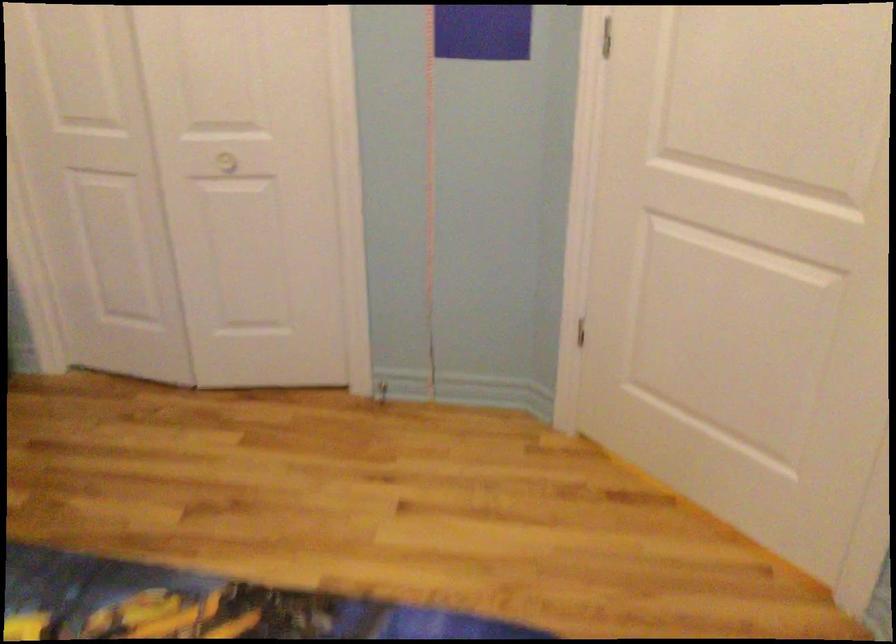
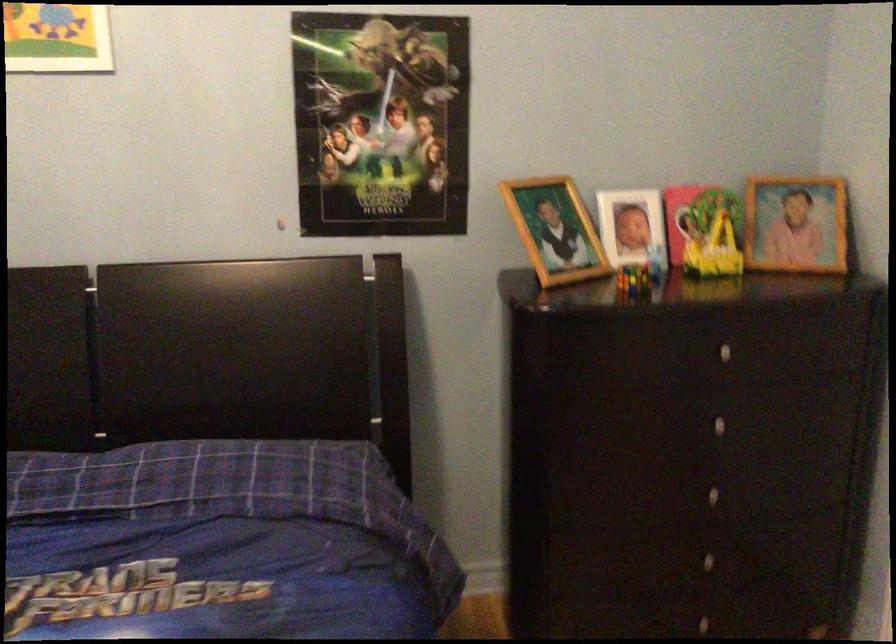
Question: The images are taken continuously from a first-person perspective. In which direction is your viewpoint rotating?

Choices:
 (A) Left
 (B) Right
 (C) Up
 (D) Down

Answer: (A)